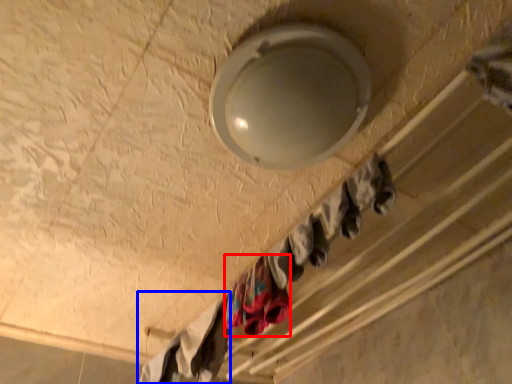
Question: Which object is closer to the camera taking this photo, clothing (highlighted by a red box) or clothing (highlighted by a blue box)?

Choices:
 (A) clothing
 (B) clothing

Answer: (A)